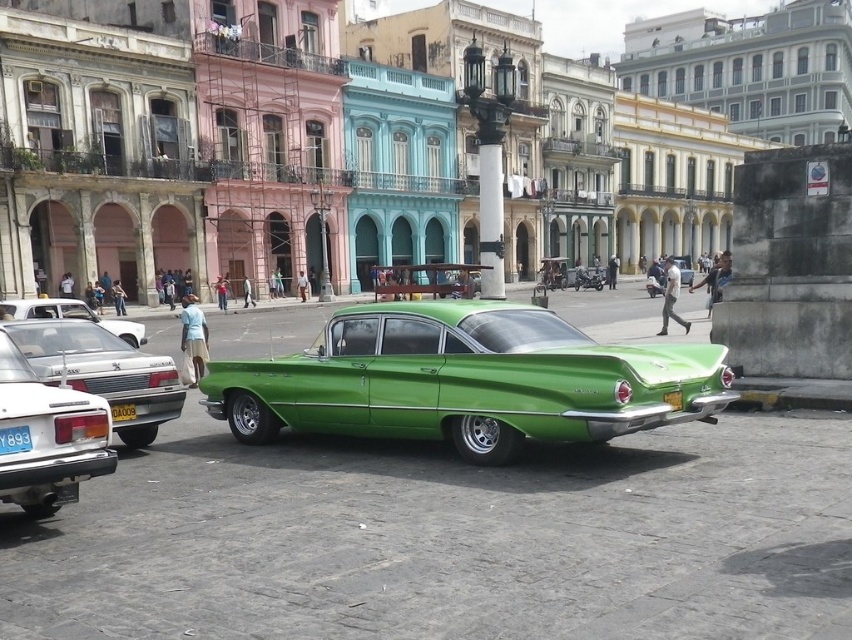
Question: Can you confirm if green glossy car at center is positioned below matte silver sedan at lower left?

Choices:
 (A) yes
 (B) no

Answer: (B)

Question: Which object is closer to the camera taking this photo?

Choices:
 (A) green glossy car at center
 (B) matte silver sedan at left
 (C) matte silver sedan at lower left
 (D) matte silver taxi at lower left

Answer: (C)

Question: Which object is closer to the camera taking this photo?

Choices:
 (A) matte silver sedan at left
 (B) matte silver taxi at lower left
 (C) blue plastic license plate at lower left

Answer: (C)

Question: Which point is farther to the camera?

Choices:
 (A) green glossy car at center
 (B) matte silver sedan at lower left

Answer: (A)

Question: Does green glossy car at center have a smaller size compared to yellow matte license plate at center?

Choices:
 (A) no
 (B) yes

Answer: (A)

Question: Does matte silver sedan at lower left have a greater width compared to blue plastic license plate at lower left?

Choices:
 (A) yes
 (B) no

Answer: (A)